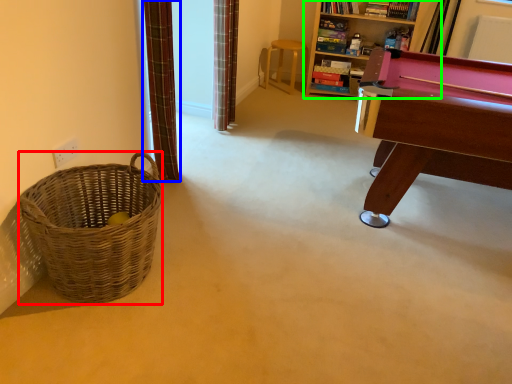
Question: Which is nearer to the basket (highlighted by a red box)? curtain (highlighted by a blue box) or bookcase (highlighted by a green box).

Choices:
 (A) curtain
 (B) bookcase

Answer: (A)